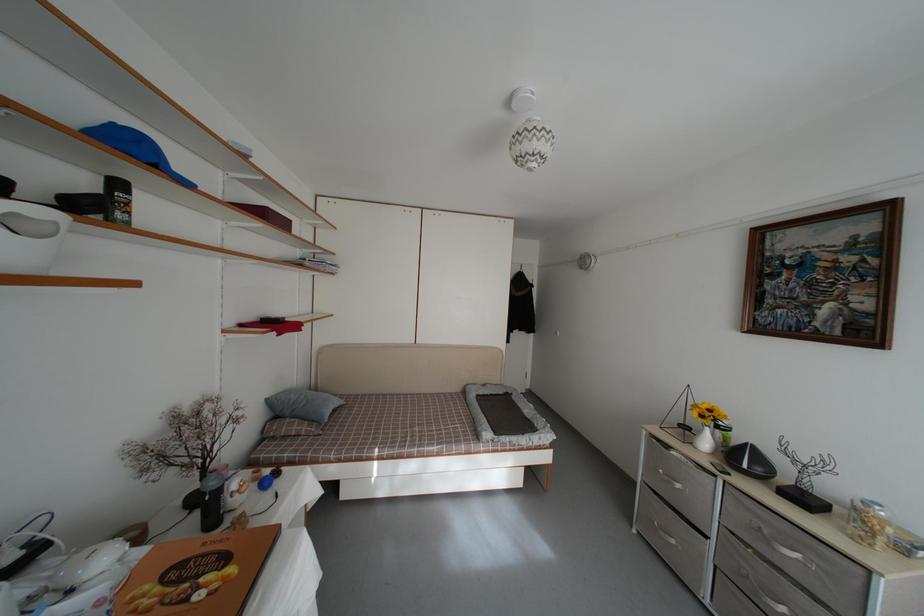
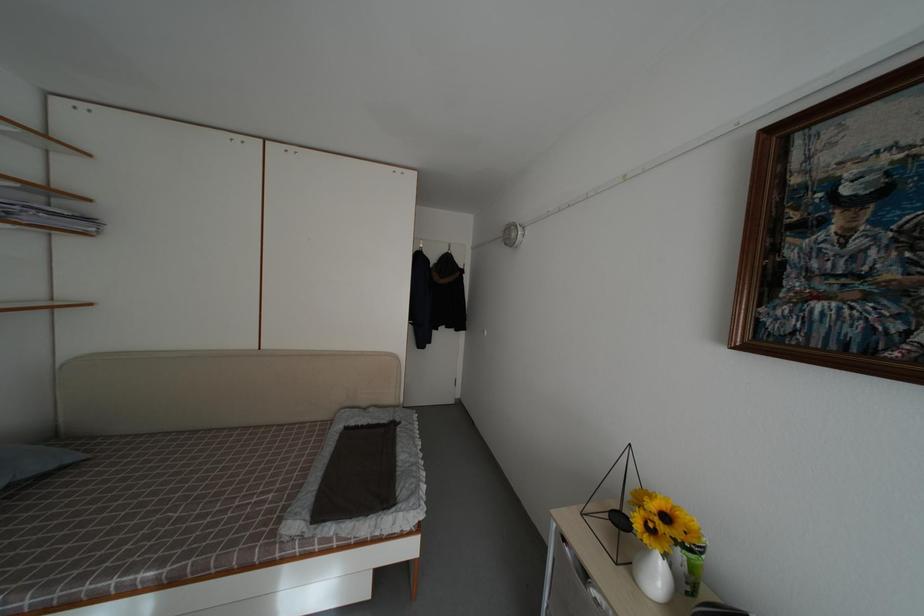
Find the pixel in the second image that matches point (341, 272) in the first image.

(94, 225)